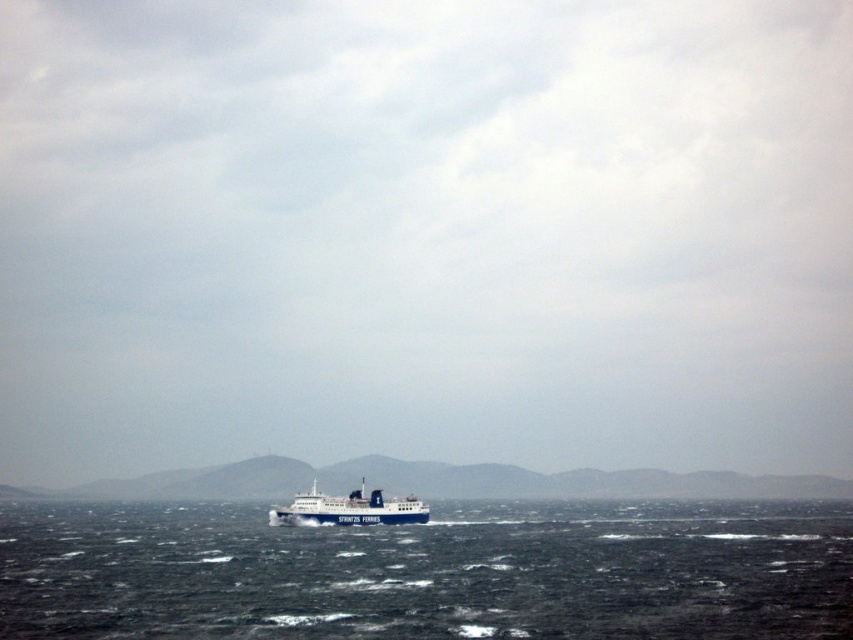
Question: Among these points, which one is farthest from the camera?

Choices:
 (A) (821, 592)
 (B) (416, 513)

Answer: (B)

Question: Based on their relative distances, which object is farther from the blue matte ferry at center?

Choices:
 (A) white matte horizon at center
 (B) dark blue water at center

Answer: (A)

Question: Can you confirm if dark blue water at center is positioned below blue matte ferry at center?

Choices:
 (A) yes
 (B) no

Answer: (A)

Question: Which object is positioned closest to the white matte horizon at center?

Choices:
 (A) blue matte ferry at center
 (B) dark blue water at center

Answer: (B)

Question: Observing the image, what is the correct spatial positioning of dark blue water at center in reference to blue matte ferry at center?

Choices:
 (A) left
 (B) right

Answer: (B)

Question: Is dark blue water at center thinner than white matte horizon at center?

Choices:
 (A) no
 (B) yes

Answer: (B)